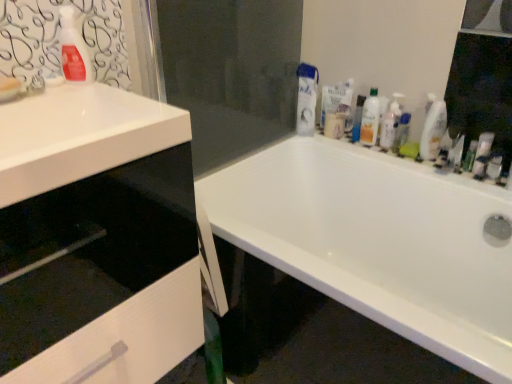
Question: Can you confirm if clear glass mirror at upper right is taller than green matte tube at right, which is the 2th toiletry from right to left?

Choices:
 (A) yes
 (B) no

Answer: (A)

Question: Considering the relative positions of clear glass mirror at upper right and green matte tube at right, which is the 2th toiletry from right to left, in the image provided, is clear glass mirror at upper right to the right of green matte tube at right, which is the 2th toiletry from right to left, from the viewer's perspective?

Choices:
 (A) no
 (B) yes

Answer: (B)

Question: From the image's perspective, does clear glass mirror at upper right appear higher than green matte tube at right, which is the second toiletry in left-to-right order?

Choices:
 (A) yes
 (B) no

Answer: (A)

Question: Can you confirm if clear glass mirror at upper right is shorter than green matte tube at right, placed as the second toiletry when sorted from front to back?

Choices:
 (A) no
 (B) yes

Answer: (A)

Question: Considering the relative sizes of clear glass mirror at upper right and green matte tube at right, which is the 2th toiletry from right to left, in the image provided, is clear glass mirror at upper right smaller than green matte tube at right, which is the 2th toiletry from right to left,?

Choices:
 (A) no
 (B) yes

Answer: (A)

Question: Considering the positions of translucent plastic bottle at upper right, the 3th cleaning product from the left, and green matte tube at right, which is the second toiletry in left-to-right order, in the image, is translucent plastic bottle at upper right, the 3th cleaning product from the left, bigger or smaller than green matte tube at right, which is the second toiletry in left-to-right order,?

Choices:
 (A) small
 (B) big

Answer: (B)

Question: From the image's perspective, relative to green matte tube at right, positioned as the second toiletry in back-to-front order, is translucent plastic bottle at upper right, the fourth cleaning product from the front, above or below?

Choices:
 (A) below
 (B) above

Answer: (B)

Question: From a real-world perspective, is translucent plastic bottle at upper right, the 2th cleaning product when ordered from back to front, positioned above or below green matte tube at right, positioned as the second toiletry in back-to-front order?

Choices:
 (A) below
 (B) above

Answer: (B)

Question: Considering the positions of translucent plastic bottle at upper right, the third cleaning product when ordered from right to left, and green matte tube at right, which is the second toiletry in left-to-right order, in the image, is translucent plastic bottle at upper right, the third cleaning product when ordered from right to left, taller or shorter than green matte tube at right, which is the second toiletry in left-to-right order,?

Choices:
 (A) short
 (B) tall

Answer: (B)

Question: From the image's perspective, relative to white glossy bottle at upper right, placed as the 4th cleaning product when sorted from back to front, is clear plastic tube at upper right, marked as the first toiletry in a right-to-left arrangement, above or below?

Choices:
 (A) above
 (B) below

Answer: (B)

Question: Is clear plastic tube at upper right, marked as the first toiletry in a right-to-left arrangement, in front of or behind white glossy bottle at upper right, marked as the 1th cleaning product in a right-to-left arrangement, in the image?

Choices:
 (A) front
 (B) behind

Answer: (A)

Question: In the image, is clear plastic tube at upper right, marked as the first toiletry in a right-to-left arrangement, on the left side or the right side of white glossy bottle at upper right, acting as the fifth cleaning product starting from the left?

Choices:
 (A) right
 (B) left

Answer: (A)

Question: From a real-world perspective, is clear plastic tube at upper right, marked as the 3th toiletry in a left-to-right arrangement, positioned above or below white glossy bottle at upper right, placed as the 4th cleaning product when sorted from back to front?

Choices:
 (A) below
 (B) above

Answer: (A)

Question: Choose the correct answer: Is white glossy bottle at upper right, marked as the 1th cleaning product in a right-to-left arrangement, inside white matte fabric at upper right, which is the 1th cleaning product in back-to-front order, or outside it?

Choices:
 (A) inside
 (B) outside

Answer: (B)

Question: Is white glossy bottle at upper right, acting as the fifth cleaning product starting from the left, in front of or behind white matte fabric at upper right, positioned as the fifth cleaning product in front-to-back order, in the image?

Choices:
 (A) front
 (B) behind

Answer: (A)